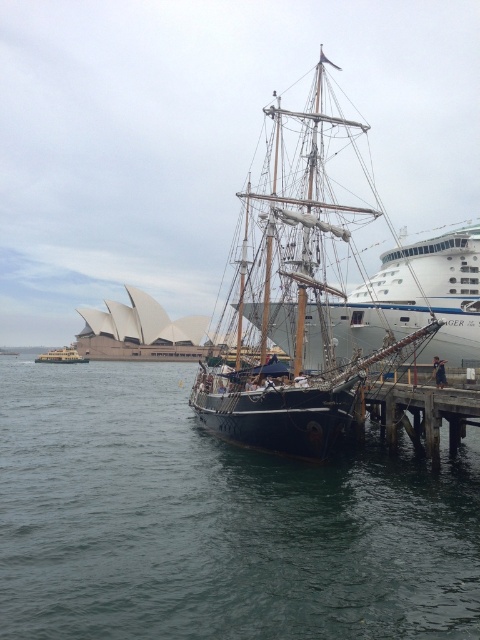
Question: Which point appears closest to the camera in this image?

Choices:
 (A) (274, 196)
 (B) (417, 444)
 (C) (310, 326)

Answer: (A)

Question: Estimate the real-world distances between objects in this image. Which object is farther from the dark blue water at center?

Choices:
 (A) yellow matte ferry at lower left
 (B) dark wood ship at center
 (C) wooden pier at lower right
 (D) white glossy cruise ship at center

Answer: (A)

Question: Can you confirm if dark wood ship at center is wider than wooden pier at lower right?

Choices:
 (A) yes
 (B) no

Answer: (A)

Question: Does wooden pier at lower right have a greater width compared to yellow matte ferry at lower left?

Choices:
 (A) yes
 (B) no

Answer: (B)

Question: Which object is closer to the camera taking this photo?

Choices:
 (A) wooden pier at lower right
 (B) dark wood ship at center

Answer: (B)

Question: Is white glossy cruise ship at center to the left of yellow matte ferry at lower left from the viewer's perspective?

Choices:
 (A) no
 (B) yes

Answer: (A)